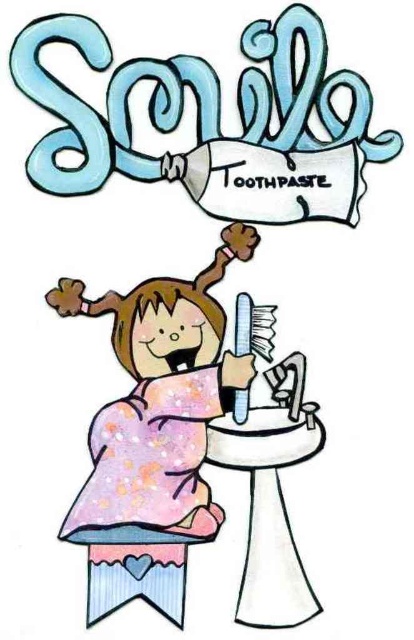
Is blue paper toothpaste at upper center positioned in front of pastel glitter dress at center?

Yes.

Is blue paper toothpaste at upper center thinner than pastel glitter dress at center?

Incorrect, blue paper toothpaste at upper center's width is not less than pastel glitter dress at center's.

Find the location of `blue paper toothpaste at upper center`. blue paper toothpaste at upper center is located at coordinates (211, 124).

Is point (281, 131) farther from viewer compared to point (142, 556)?

Yes, it is behind point (142, 556).

Does blue paper toothpaste at upper center have a greater width compared to pastel fabric stool at lower center?

Yes.

Which is in front, point (36, 80) or point (158, 572)?

Point (36, 80) is more forward.

Locate an element on the screen. blue paper toothpaste at upper center is located at coordinates (211, 124).

Does white glossy sink at center have a larger size compared to pastel fabric stool at lower center?

Yes.

Is point (245, 589) behind point (134, 589)?

Yes, point (245, 589) is farther from viewer.

This screenshot has height=640, width=414. What are the coordinates of `white glossy sink at center` in the screenshot? It's located at click(269, 512).